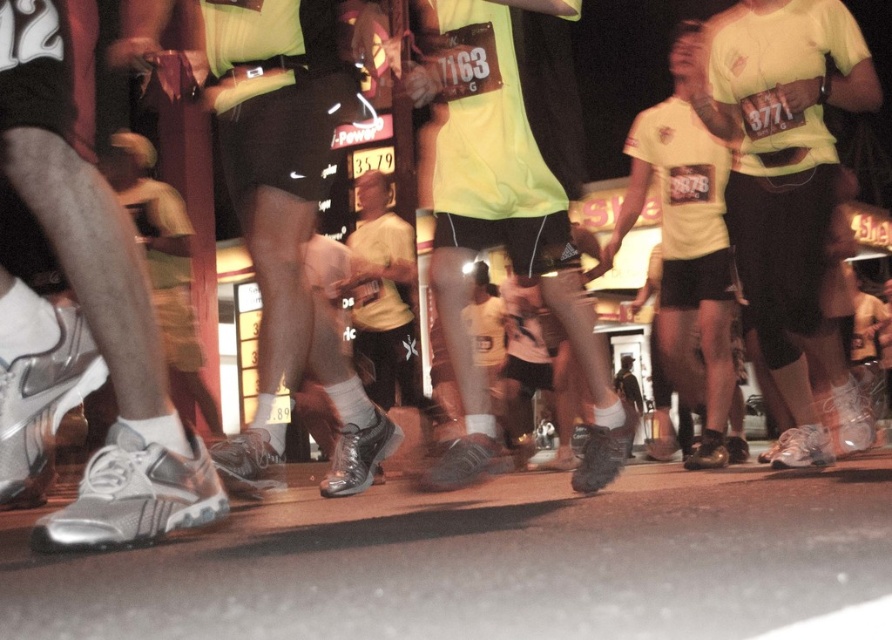
Which is behind, point (800, 284) or point (539, 161)?

Positioned behind is point (800, 284).

Is matte white shoe at center shorter than matte yellow shirt at center?

In fact, matte white shoe at center may be taller than matte yellow shirt at center.

The width and height of the screenshot is (892, 640). Find the location of `matte white shoe at center`. matte white shoe at center is located at coordinates (787, 193).

Who is higher up, silver metallic shoe at lower left or matte yellow shirt at center?

matte yellow shirt at center is higher up.

Where is `silver metallic shoe at lower left`? silver metallic shoe at lower left is located at coordinates (85, 301).

What do you see at coordinates (85, 301) in the screenshot? I see `silver metallic shoe at lower left` at bounding box center [85, 301].

Does point (43, 156) come behind point (857, 444)?

No, (43, 156) is closer to viewer.

At what (x,y) coordinates should I click in order to perform the action: click on silver metallic shoe at lower left. Please return your answer as a coordinate pair (x, y). This screenshot has height=640, width=892. Looking at the image, I should click on (85, 301).